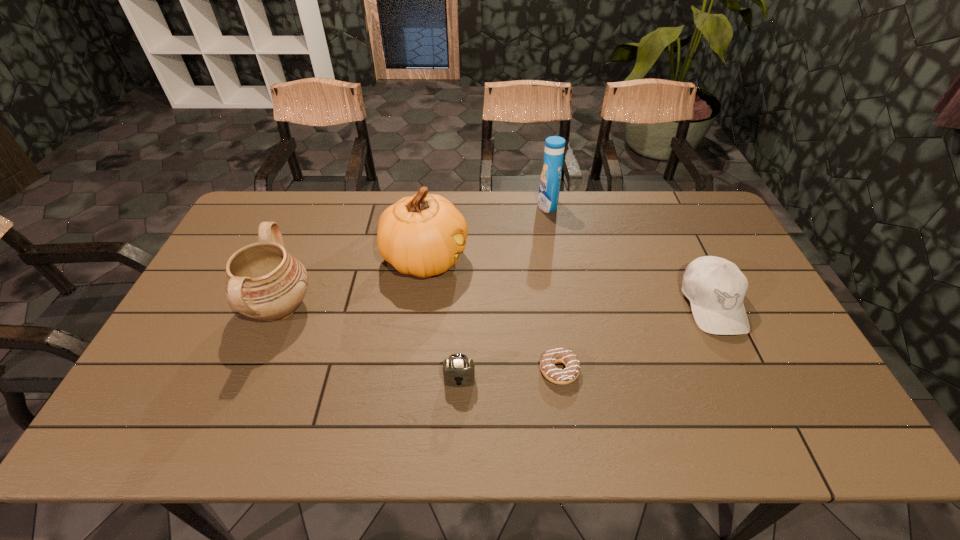
I want to click on vacant area situated 0.220m on the front-facing side of the urn, so click(394, 307).

Image resolution: width=960 pixels, height=540 pixels. What are the coordinates of `vacant region located 0.160m on the front-facing side of the baseball cap` in the screenshot? It's located at (756, 394).

Identify the location of free point located 0.050m at the front of the second shortest object near the keyhole. (459, 407).

Image resolution: width=960 pixels, height=540 pixels. I want to click on vacant point located on the back of the doughnut, so click(549, 299).

You are a GUI agent. You are given a task and a screenshot of the screen. Output one action in this format:
    pyautogui.click(x=<x>, y=<y>)
    Task: Click on the detergent located at the far edge
    This screenshot has height=540, width=960.
    Given the screenshot: What is the action you would take?
    pyautogui.click(x=550, y=180)

Image resolution: width=960 pixels, height=540 pixels. Find the location of `pumpkin that is at the far edge`. pumpkin that is at the far edge is located at coordinates (422, 235).

Locate an element on the screen. The width and height of the screenshot is (960, 540). object present at the left edge is located at coordinates [x=264, y=282].

Where is `object that is at the right edge`? This screenshot has height=540, width=960. object that is at the right edge is located at coordinates (715, 287).

Where is `vacant area at the far edge of the desktop`? vacant area at the far edge of the desktop is located at coordinates (621, 193).

In the image, there is a desktop. Where is `vacant space at the near edge`? vacant space at the near edge is located at coordinates (416, 444).